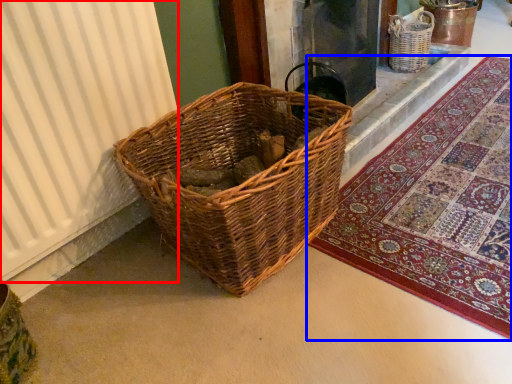
Question: Among these objects, which one is nearest to the camera, curtain (highlighted by a red box) or mat (highlighted by a blue box)?

Choices:
 (A) curtain
 (B) mat

Answer: (A)